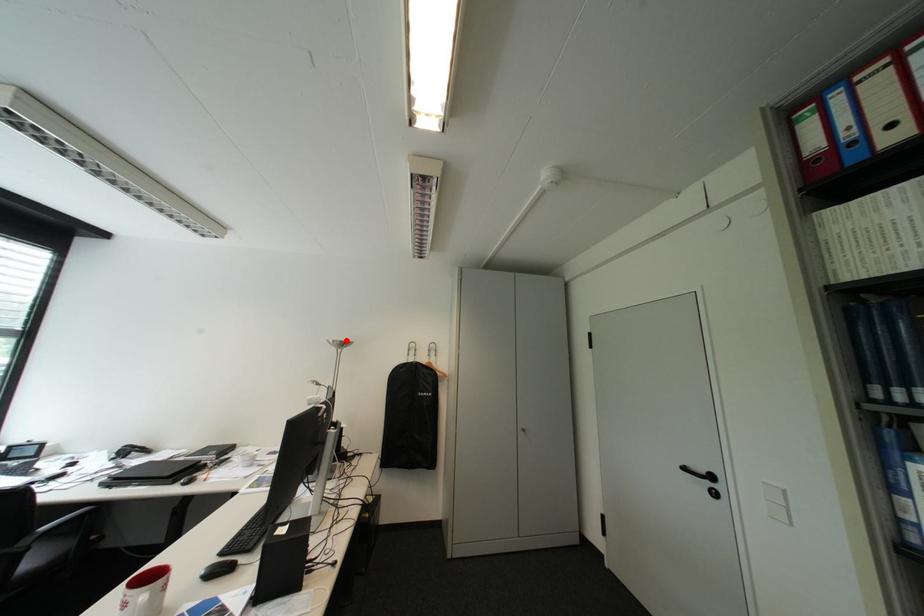
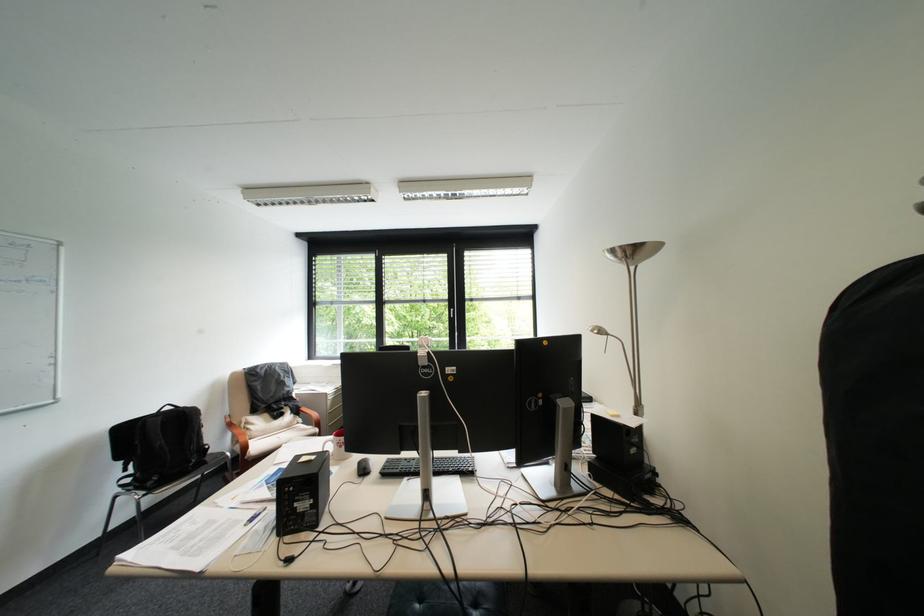
Locate, in the second image, the point that corresponds to the highlighted location in the first image.

(625, 252)